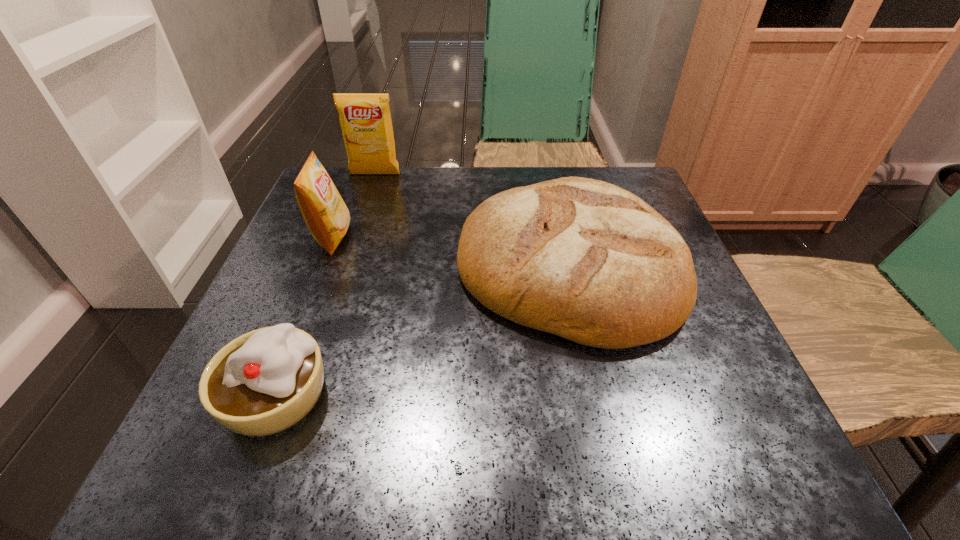
The height and width of the screenshot is (540, 960). I want to click on free space that satisfies the following two spatial constraints: 1. on the back side of the rightmost object; 2. on the front-facing side of the third shortest object, so click(x=563, y=238).

Where is `vacant space that satisfies the following two spatial constraints: 1. on the front-facing side of the nearer crisp (potato chip); 2. on the back side of the whipped cream`? This screenshot has height=540, width=960. vacant space that satisfies the following two spatial constraints: 1. on the front-facing side of the nearer crisp (potato chip); 2. on the back side of the whipped cream is located at coordinates (271, 395).

Where is `free point that satisfies the following two spatial constraints: 1. on the back side of the whipped cream; 2. on the front-facing side of the nearer crisp (potato chip)`? free point that satisfies the following two spatial constraints: 1. on the back side of the whipped cream; 2. on the front-facing side of the nearer crisp (potato chip) is located at coordinates (337, 238).

Locate an element on the screen. vacant space that satisfies the following two spatial constraints: 1. on the front-facing side of the whipped cream; 2. on the left side of the nearer crisp (potato chip) is located at coordinates (271, 395).

The image size is (960, 540). Find the location of `free space that satisfies the following two spatial constraints: 1. on the front of the farther crisp (potato chip) with the logo; 2. on the front-facing side of the third shortest object`. free space that satisfies the following two spatial constraints: 1. on the front of the farther crisp (potato chip) with the logo; 2. on the front-facing side of the third shortest object is located at coordinates (353, 238).